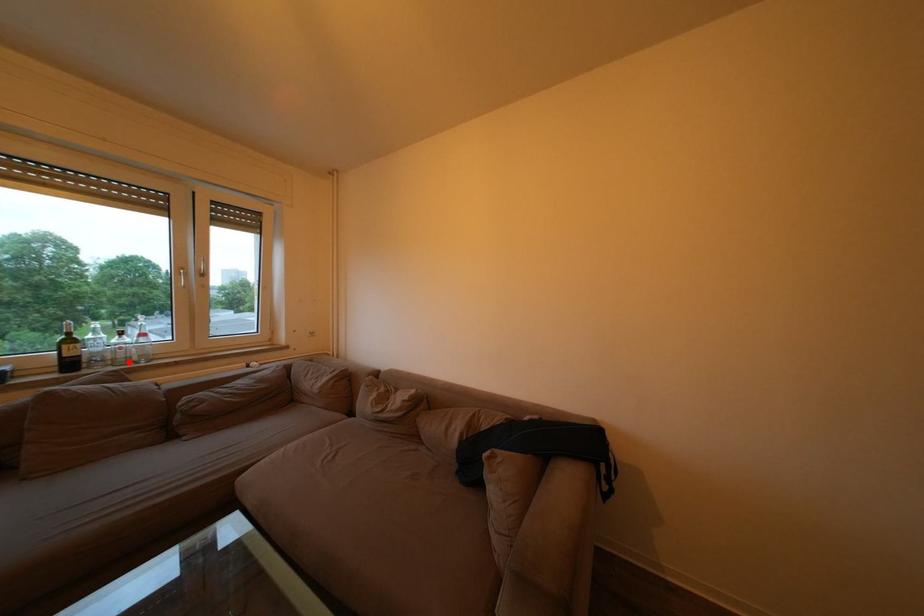
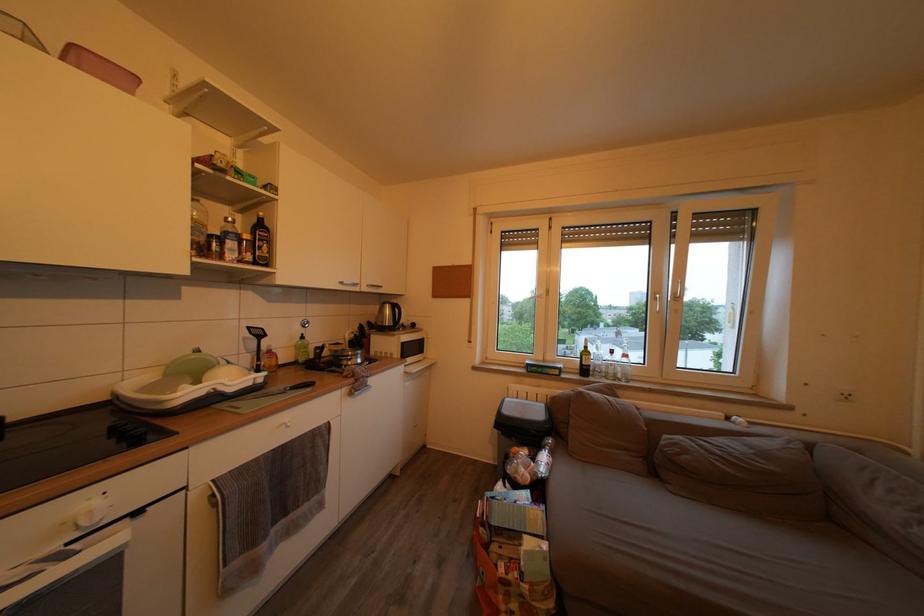
Locate, in the second image, the point that corresponds to the highlighted location in the first image.

(618, 378)